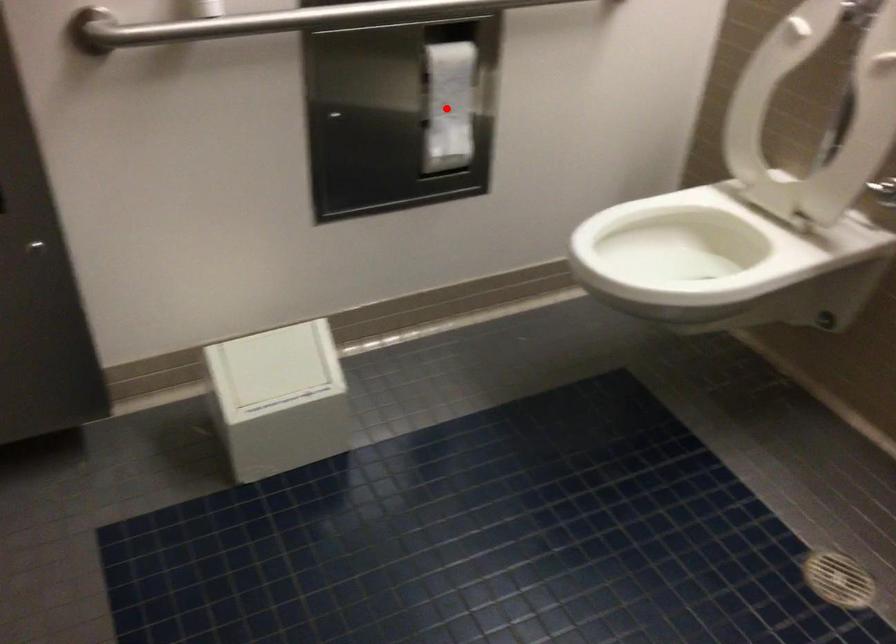
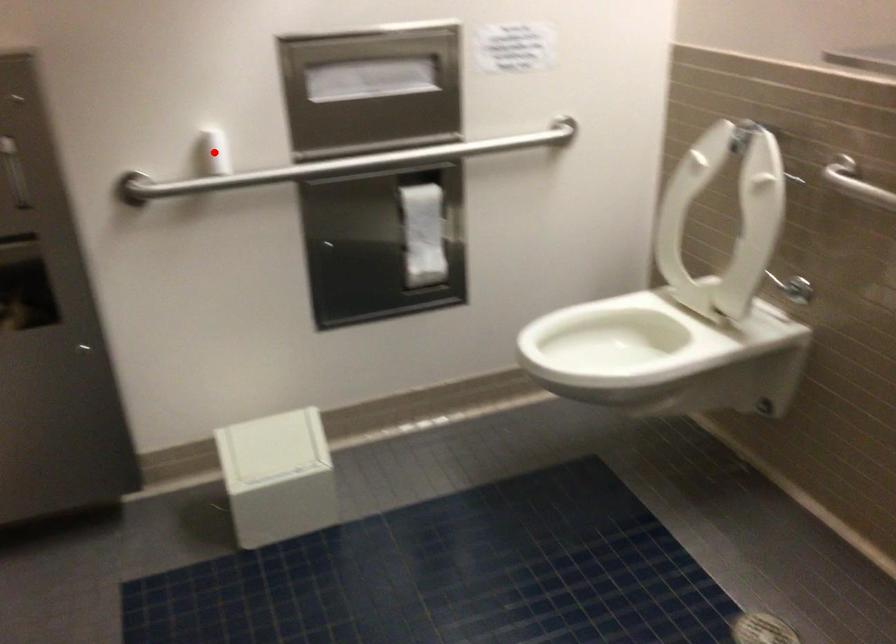
I am providing you with two images of the same scene from different viewpoints. A red point is marked on the first image and another point is marked on the second image. Is the marked point in image1 the same physical position as the marked point in image2?

No